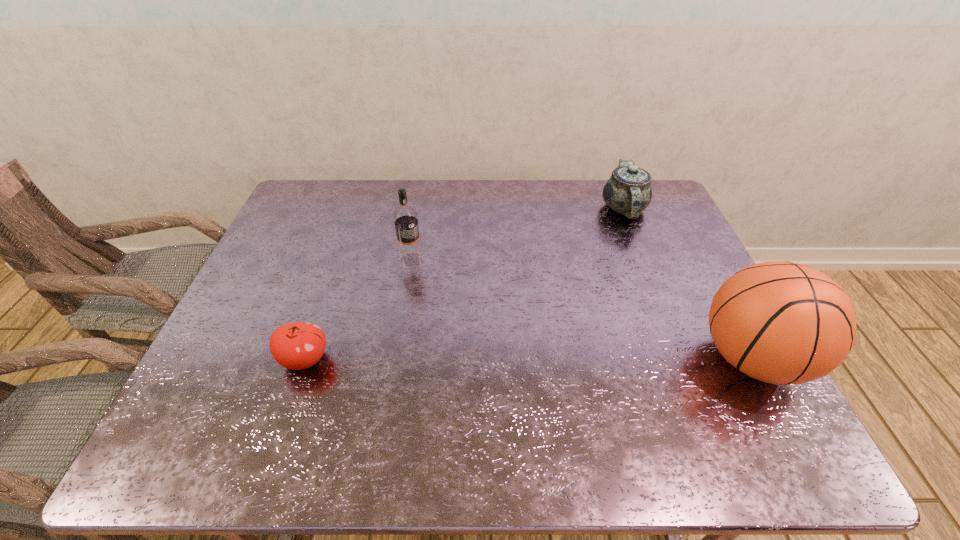
Locate an element on the screen. free space on the desktop that is between the apple and the basketball and is positioned on the label of the second farthest object is located at coordinates (466, 359).

At what (x,y) coordinates should I click in order to perform the action: click on free spot on the desktop that is between the shortest object and the basketball and is positioned from the spout of the farthest object. Please return your answer as a coordinate pair (x, y). The image size is (960, 540). Looking at the image, I should click on (573, 359).